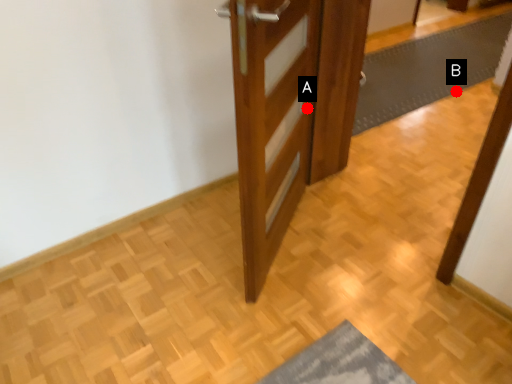
Question: Two points are circled on the image, labeled by A and B beside each circle. Which of the following is the farthest from the observer?

Choices:
 (A) A is further
 (B) B is further

Answer: (B)